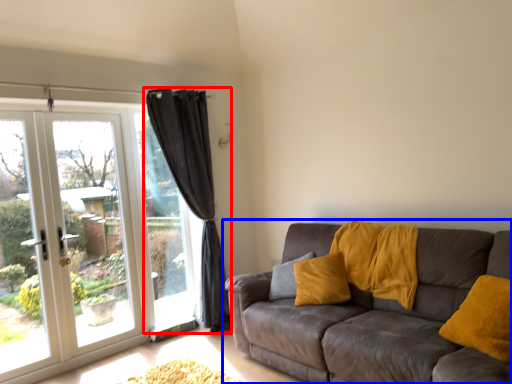
Question: Which of the following is the farthest to the observer, curtain (highlighted by a red box) or studio couch (highlighted by a blue box)?

Choices:
 (A) curtain
 (B) studio couch

Answer: (A)